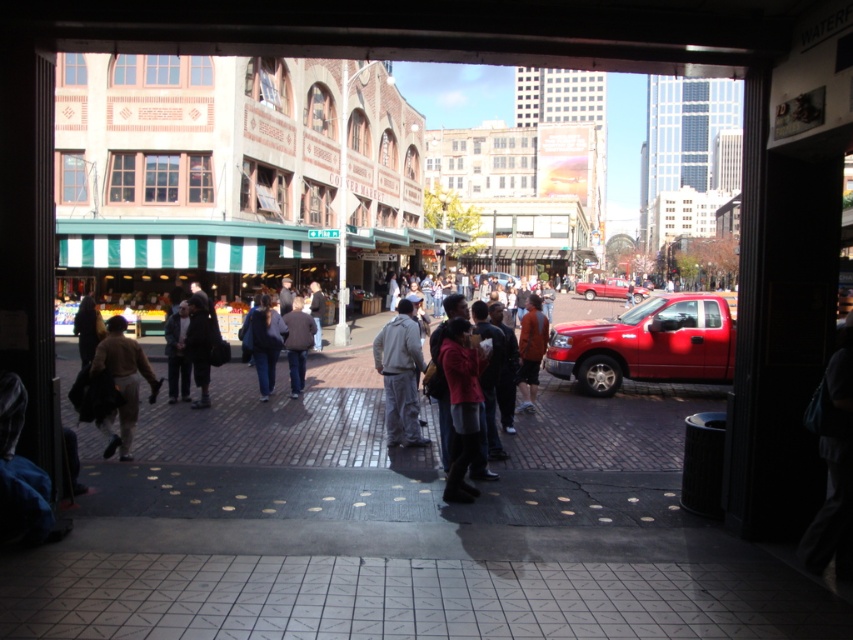
Does brick pavement at center appear under dark gray coat at center?

Yes, brick pavement at center is below dark gray coat at center.

Is brick pavement at center to the left of dark gray coat at center from the viewer's perspective?

Incorrect, brick pavement at center is not on the left side of dark gray coat at center.

Where is `brick pavement at center`? The width and height of the screenshot is (853, 640). brick pavement at center is located at coordinates (399, 529).

Does point (200, 312) lie behind point (296, 362)?

No, it is in front of (296, 362).

What are the coordinates of `dark gray coat at center` in the screenshot? It's located at (200, 344).

Between dark blue jeans at center and dark gray coat at center, which one has more height?

Standing taller between the two is dark gray coat at center.

Which of these two, dark blue jeans at center or dark gray coat at center, stands shorter?

With less height is dark blue jeans at center.

Is point (256, 372) closer to viewer compared to point (206, 324)?

No, it is not.

This screenshot has width=853, height=640. In order to click on dark blue jeans at center in this screenshot , I will do `click(263, 340)`.